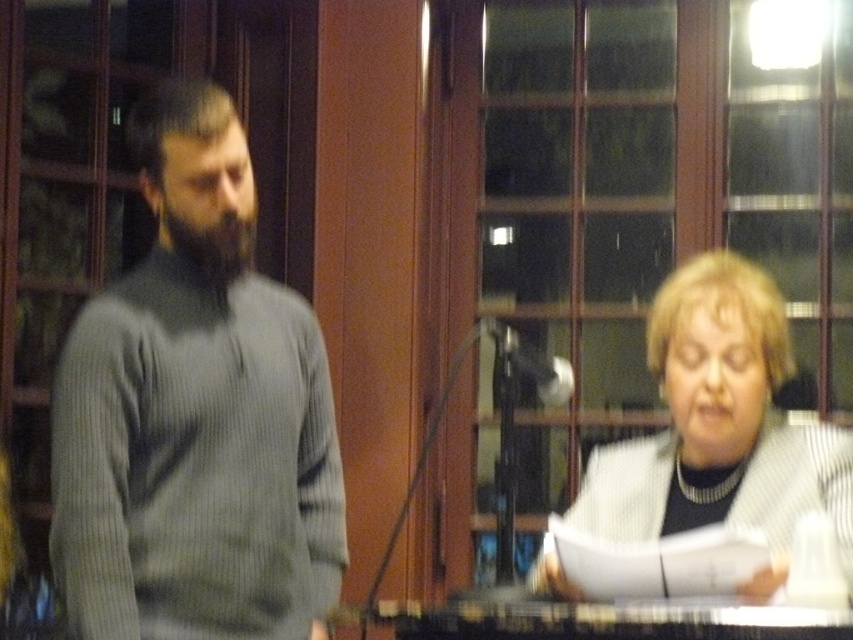
Is point (206, 136) less distant than point (827, 636)?

No, (206, 136) is further to viewer.

Is gray ribbed sweater at left in front of black plastic table at lower center?

No, gray ribbed sweater at left is behind black plastic table at lower center.

This screenshot has width=853, height=640. Describe the element at coordinates (195, 413) in the screenshot. I see `gray ribbed sweater at left` at that location.

What are the coordinates of `gray ribbed sweater at left` in the screenshot? It's located at (195, 413).

Does point (694, 422) come behind point (445, 605)?

That is True.

Based on the photo, is white textured sweater at lower right thinner than black plastic table at lower center?

Indeed, white textured sweater at lower right has a lesser width compared to black plastic table at lower center.

Who is more forward, (717, 426) or (556, 609)?

Point (556, 609)

Where is `white textured sweater at lower right`? The image size is (853, 640). white textured sweater at lower right is located at coordinates (718, 422).

Can you confirm if gray ribbed sweater at left is smaller than white textured sweater at lower right?

No.

Can you confirm if gray ribbed sweater at left is positioned above white textured sweater at lower right?

Yes, gray ribbed sweater at left is above white textured sweater at lower right.

Is point (181, 499) more distant than point (608, 492)?

No.

This screenshot has width=853, height=640. In order to click on gray ribbed sweater at left in this screenshot , I will do `click(195, 413)`.